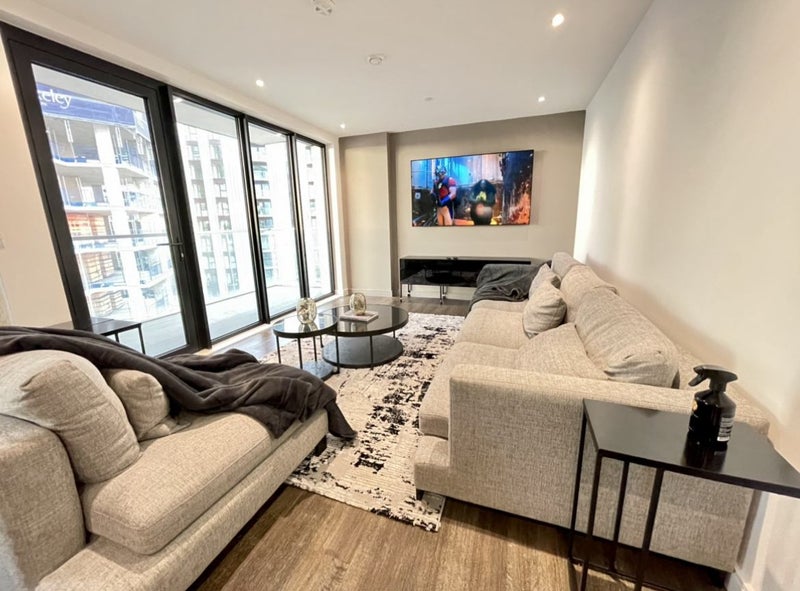
This screenshot has width=800, height=591. What are the coordinates of `wall` in the screenshot? It's located at (713, 131).